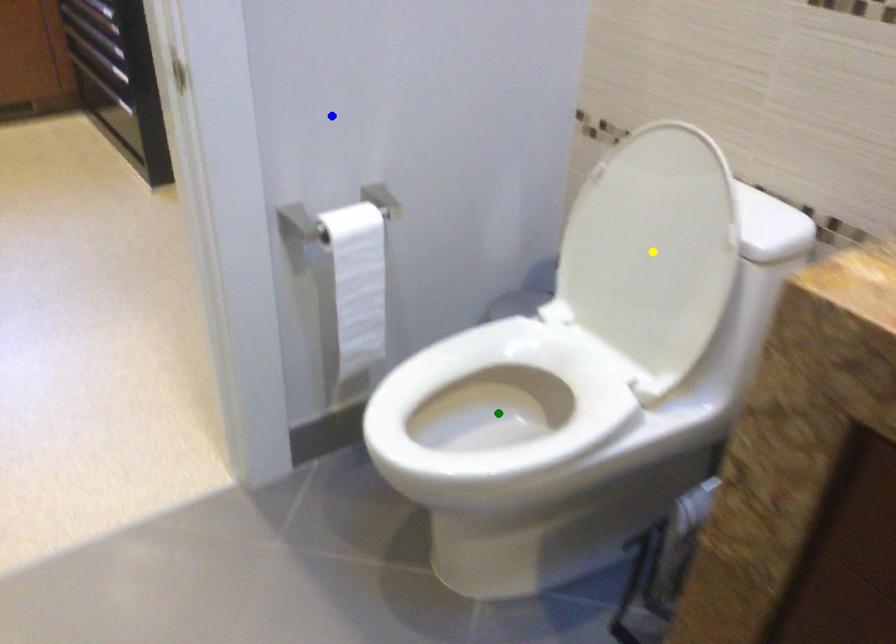
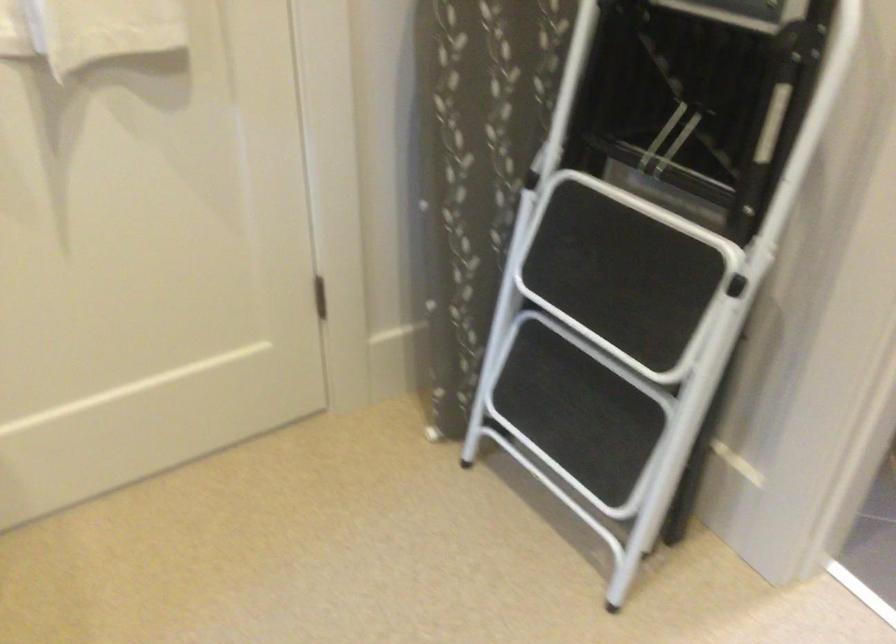
I am providing you with two images of the same scene from different viewpoints. Three points are marked in image1. Which point corresponds to a part or object that is occluded in image2?In image1, three points are marked. Which of them correspond to a part or object that is occluded in image2?Among the three points shown in image1, which one corresponds to a part or object that is no longer visible due to occlusion in image2?

Invisible in image2: yellow point, green point.